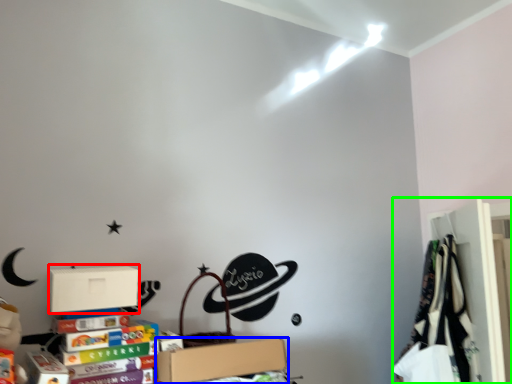
Question: Considering the real-world distances, which object is farthest from cardboard box (highlighted by a red box)? box (highlighted by a blue box) or closet (highlighted by a green box)?

Choices:
 (A) box
 (B) closet

Answer: (B)